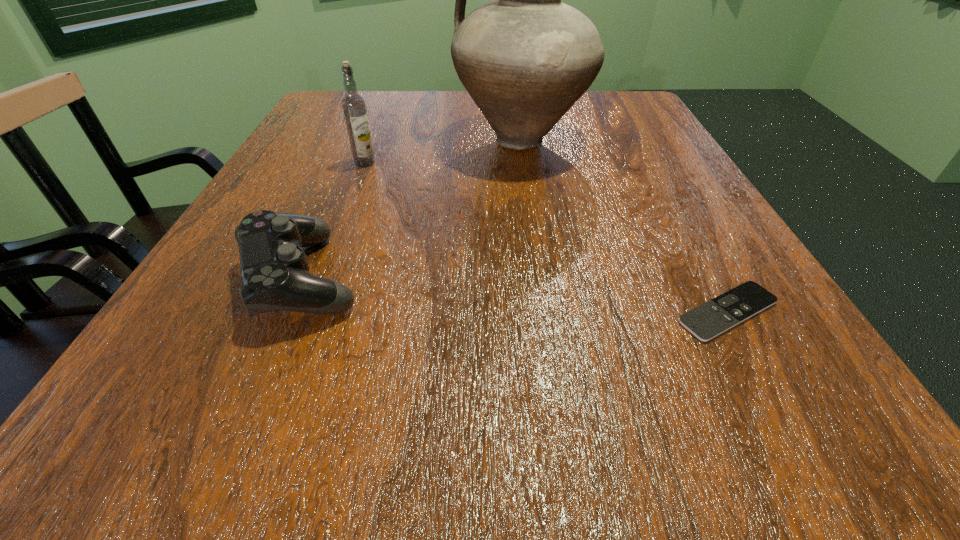
Locate an element on the screen. The image size is (960, 540). free space located 0.330m on the right of the control is located at coordinates (595, 277).

Locate an element on the screen. free space located on the back of the rightmost object is located at coordinates (692, 248).

Locate an element on the screen. The width and height of the screenshot is (960, 540). object present at the far edge is located at coordinates (525, 58).

I want to click on vodka located at the left edge, so click(x=354, y=108).

Find the location of a particular element. This screenshot has height=540, width=960. control at the left edge is located at coordinates (275, 273).

Locate an element on the screen. object situated at the right edge is located at coordinates (712, 318).

In the image, there is a desktop. At what (x,y) coordinates should I click in order to perform the action: click on vacant space at the far edge. Please return your answer as a coordinate pair (x, y). This screenshot has height=540, width=960. Looking at the image, I should click on (415, 118).

Image resolution: width=960 pixels, height=540 pixels. Identify the location of vacant region at the near edge of the desktop. (702, 433).

Locate an element on the screen. vacant region at the left edge of the desktop is located at coordinates (341, 147).

This screenshot has width=960, height=540. Find the location of `free space at the far left corner of the desktop`. free space at the far left corner of the desktop is located at coordinates (366, 94).